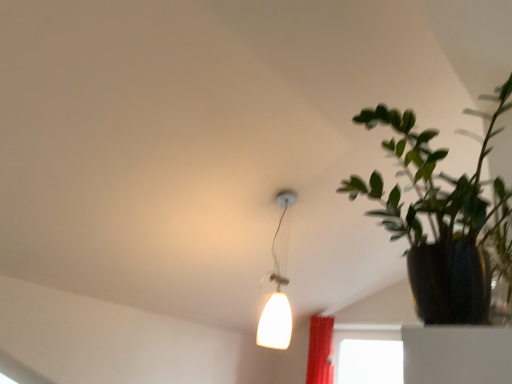
Question: In terms of height, does white glossy lampshade at upper center look taller or shorter compared to green matte plant at right?

Choices:
 (A) short
 (B) tall

Answer: (B)

Question: Choose the correct answer: Is white glossy lampshade at upper center inside green matte plant at right or outside it?

Choices:
 (A) inside
 (B) outside

Answer: (B)

Question: Considering their positions, is white glossy lampshade at upper center located in front of or behind green matte plant at right?

Choices:
 (A) front
 (B) behind

Answer: (B)

Question: In the image, is green matte plant at right positioned in front of or behind white glossy lampshade at upper center?

Choices:
 (A) front
 (B) behind

Answer: (A)

Question: Looking at the image, does green matte plant at right seem bigger or smaller compared to white glossy lampshade at upper center?

Choices:
 (A) big
 (B) small

Answer: (A)

Question: From a real-world perspective, is green matte plant at right positioned above or below white glossy lampshade at upper center?

Choices:
 (A) below
 (B) above

Answer: (A)

Question: From the image's perspective, is green matte plant at right positioned above or below white glossy lampshade at upper center?

Choices:
 (A) below
 (B) above

Answer: (B)